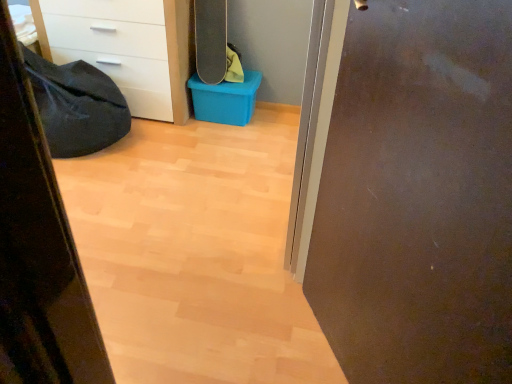
The height and width of the screenshot is (384, 512). In order to click on blue plastic storage box at center in this screenshot , I will do `click(225, 99)`.

Describe the element at coordinates (210, 40) in the screenshot. I see `black matte skateboard at upper center` at that location.

This screenshot has height=384, width=512. What are the coordinates of `white glossy chest of drawers at upper left` in the screenshot? It's located at (126, 48).

Measure the distance between blue plastic storage box at center and matte brown door at right.

The distance of blue plastic storage box at center from matte brown door at right is 5.76 feet.

Which object is further away from the camera, blue plastic storage box at center or matte brown door at right?

blue plastic storage box at center is further away from the camera.

The width and height of the screenshot is (512, 384). In order to click on door located above the blue plastic storage box at center (from a real-world perspective) in this screenshot , I will do `click(418, 196)`.

Is blue plastic storage box at center directly adjacent to matte brown door at right?

No, blue plastic storage box at center is not next to matte brown door at right.

From the image's perspective, would you say matte brown door at right is positioned over black fabric sleeping bag at left?

No, from the image's perspective, matte brown door at right is not on top of black fabric sleeping bag at left.

Which is less distant, [402,244] or [68,77]?

Clearly, point [402,244] is closer to the camera than point [68,77].

Does matte brown door at right appear on the right side of black fabric sleeping bag at left?

Yes, matte brown door at right is to the right of black fabric sleeping bag at left.

Considering the sizes of matte brown door at right and black fabric sleeping bag at left in the image, is matte brown door at right wider or thinner than black fabric sleeping bag at left?

matte brown door at right is thinner than black fabric sleeping bag at left.

Is matte brown door at right wider than black matte skateboard at upper center?

In fact, matte brown door at right might be narrower than black matte skateboard at upper center.

Does matte brown door at right turn towards black matte skateboard at upper center?

No, matte brown door at right is not oriented towards black matte skateboard at upper center.

Is matte brown door at right at the right side of black matte skateboard at upper center?

Yes.

Is matte brown door at right further to the viewer compared to black matte skateboard at upper center?

No, matte brown door at right is in front of black matte skateboard at upper center.

Which object is more forward, white glossy chest of drawers at upper left or black matte skateboard at upper center?

white glossy chest of drawers at upper left is in front.

Is white glossy chest of drawers at upper left beside black matte skateboard at upper center?

No, white glossy chest of drawers at upper left is not with black matte skateboard at upper center.

Consider the image. Visually, is white glossy chest of drawers at upper left positioned to the left or to the right of black matte skateboard at upper center?

white glossy chest of drawers at upper left is positioned on black matte skateboard at upper center's left side.

Where is `storage box located below the white glossy chest of drawers at upper left (from the image's perspective)`? storage box located below the white glossy chest of drawers at upper left (from the image's perspective) is located at coordinates (225, 99).

Is blue plastic storage box at center surrounding white glossy chest of drawers at upper left?

No, blue plastic storage box at center does not contain white glossy chest of drawers at upper left.

In the scene shown: Between blue plastic storage box at center and white glossy chest of drawers at upper left, which one appears on the left side from the viewer's perspective?

white glossy chest of drawers at upper left is more to the left.

Relative to white glossy chest of drawers at upper left, is blue plastic storage box at center in front or behind?

Visually, blue plastic storage box at center is located behind white glossy chest of drawers at upper left.

Is black matte skateboard at upper center directly adjacent to blue plastic storage box at center?

black matte skateboard at upper center and blue plastic storage box at center are clearly separated.

Does black matte skateboard at upper center have a lesser height compared to blue plastic storage box at center?

In fact, black matte skateboard at upper center may be taller than blue plastic storage box at center.

Could you tell me if black matte skateboard at upper center is facing blue plastic storage box at center?

No, black matte skateboard at upper center is not facing towards blue plastic storage box at center.

From the image's perspective, which object appears higher, black matte skateboard at upper center or blue plastic storage box at center?

black matte skateboard at upper center appears higher in the image.

What's the angular difference between matte brown door at right and blue plastic storage box at center's facing directions?

matte brown door at right and blue plastic storage box at center are facing 60 degrees away from each other.

Would you say matte brown door at right is to the left or to the right of blue plastic storage box at center in the picture?

In the image, matte brown door at right appears on the right side of blue plastic storage box at center.

From the image's perspective, is matte brown door at right located above blue plastic storage box at center?

No, from the image's perspective, matte brown door at right is not over blue plastic storage box at center.

Where is `door below the blue plastic storage box at center (from the image's perspective)`? door below the blue plastic storage box at center (from the image's perspective) is located at coordinates tap(418, 196).

In order to click on sleeping bag that appears above the matte brown door at right (from the image's perspective) in this screenshot , I will do `click(76, 106)`.

From the image, which object appears to be nearer to black fabric sleeping bag at left, white glossy chest of drawers at upper left or matte brown door at right?

→ white glossy chest of drawers at upper left is closer to black fabric sleeping bag at left.

From the image, which object appears to be nearer to black fabric sleeping bag at left, blue plastic storage box at center or matte brown door at right?

blue plastic storage box at center is closer to black fabric sleeping bag at left.

When comparing their distances from black fabric sleeping bag at left, does matte brown door at right or blue plastic storage box at center seem further?

The object further to black fabric sleeping bag at left is matte brown door at right.

Looking at the image, which one is located further to black fabric sleeping bag at left, white glossy chest of drawers at upper left or black matte skateboard at upper center?

Based on the image, black matte skateboard at upper center appears to be further to black fabric sleeping bag at left.

Looking at the image, which one is located further to white glossy chest of drawers at upper left, black matte skateboard at upper center or matte brown door at right?

The object further to white glossy chest of drawers at upper left is matte brown door at right.

From the image, which object appears to be nearer to blue plastic storage box at center, white glossy chest of drawers at upper left or matte brown door at right?

white glossy chest of drawers at upper left lies closer to blue plastic storage box at center than the other object.

When comparing their distances from black fabric sleeping bag at left, does black matte skateboard at upper center or blue plastic storage box at center seem further?

The object further to black fabric sleeping bag at left is black matte skateboard at upper center.

From the image, which object appears to be nearer to black matte skateboard at upper center, black fabric sleeping bag at left or blue plastic storage box at center?

blue plastic storage box at center.

Locate an element on the screen. The height and width of the screenshot is (384, 512). skateboard between black fabric sleeping bag at left and blue plastic storage box at center in the horizontal direction is located at coordinates (210, 40).

Identify the location of chest of drawers between black fabric sleeping bag at left and blue plastic storage box at center. The image size is (512, 384). (126, 48).

Locate an element on the screen. This screenshot has height=384, width=512. chest of drawers between black fabric sleeping bag at left and black matte skateboard at upper center from left to right is located at coordinates (126, 48).

Where is `sleeping bag between matte brown door at right and white glossy chest of drawers at upper left from front to back`? sleeping bag between matte brown door at right and white glossy chest of drawers at upper left from front to back is located at coordinates (76, 106).